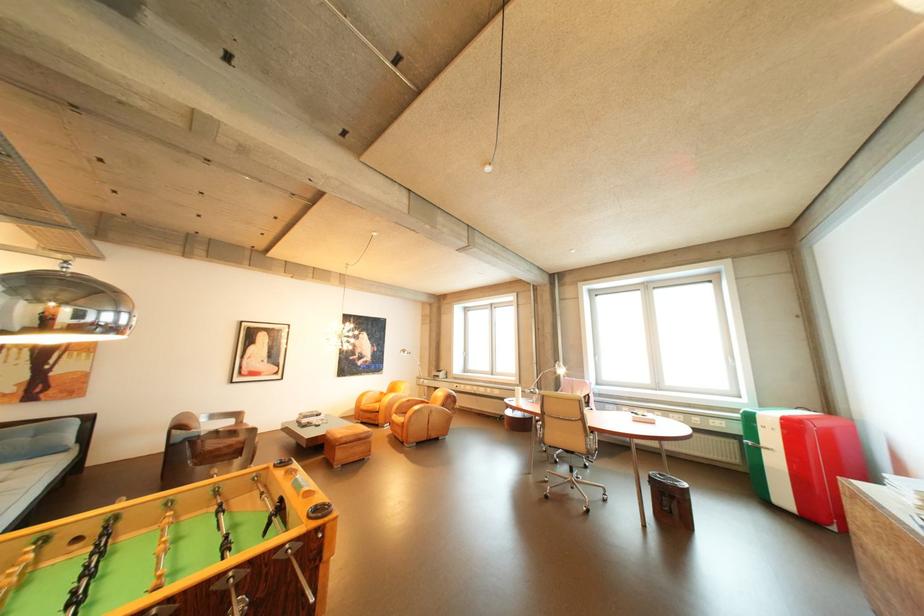
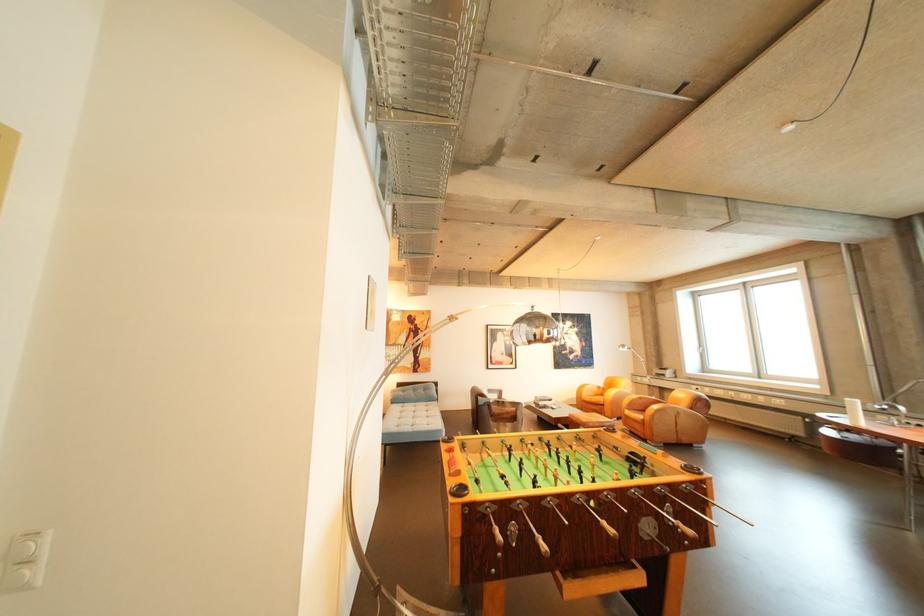
Where in the second image is the point corresponding to [377,403] from the first image?

(598, 395)